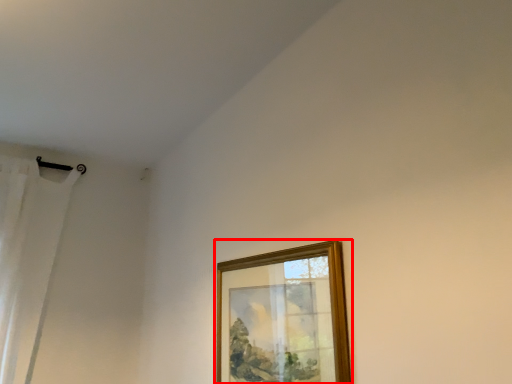
Question: Considering the relative positions of picture frame (annotated by the red box) and curtain in the image provided, where is picture frame (annotated by the red box) located with respect to the staircase?

Choices:
 (A) right
 (B) left

Answer: (A)